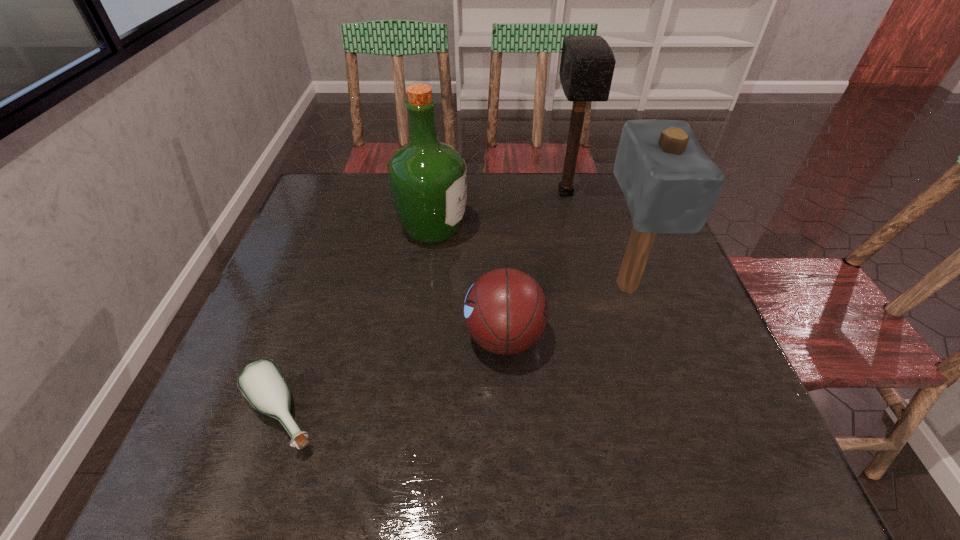
Where is `the farther mallet`? This screenshot has height=540, width=960. the farther mallet is located at coordinates (587, 64).

Locate an element on the screen. This screenshot has height=540, width=960. the nearer mallet is located at coordinates (670, 185).

Locate an element on the screen. The height and width of the screenshot is (540, 960). liquor is located at coordinates (428, 179).

Identify the location of the fourth tallest object. point(505,311).

Find the location of a particular element. The image size is (960, 540). the nearest object is located at coordinates (262, 384).

The height and width of the screenshot is (540, 960). Find the location of `the leftmost object`. the leftmost object is located at coordinates tap(262, 384).

Where is `vacant region located 0.300m on the left of the farther mallet`? This screenshot has height=540, width=960. vacant region located 0.300m on the left of the farther mallet is located at coordinates (449, 193).

Where is `free region located 0.080m on the right of the nearer mallet`? free region located 0.080m on the right of the nearer mallet is located at coordinates (685, 285).

The width and height of the screenshot is (960, 540). Identify the location of vacant space located on the front-facing side of the liquor. (585, 230).

Identify the location of blank space located 0.320m on the back of the second shortest object. (498, 220).